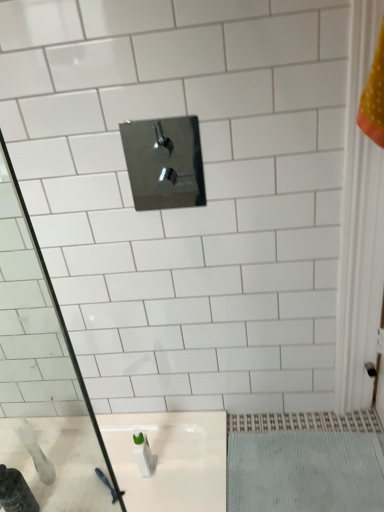
Locate an element on the screen. This screenshot has width=384, height=512. white textured bath mat at lower right is located at coordinates pos(303,472).

From the image's perspective, between polished chrome tap at upper center and white glossy bottle at lower left, which one is located above?

polished chrome tap at upper center appears higher in the image.

From a real-world perspective, is polished chrome tap at upper center physically located above or below white glossy bottle at lower left?

polished chrome tap at upper center is above white glossy bottle at lower left.

Is polished chrome tap at upper center facing away from white glossy bottle at lower left?

No, polished chrome tap at upper center is not facing the opposite direction of white glossy bottle at lower left.

Can we say polished chrome tap at upper center lies outside white glossy bottle at lower left?

Yes, polished chrome tap at upper center is located beyond the bounds of white glossy bottle at lower left.

From a real-world perspective, who is located lower, white textured bath mat at lower right or polished chrome tap at upper center?

In real-world perspective, white textured bath mat at lower right is lower.

Consider the image. Which is behind, white textured bath mat at lower right or polished chrome tap at upper center?

white textured bath mat at lower right is further from the camera.

Find the location of a particular element. This screenshot has height=512, width=384. bath mat on the right of polished chrome tap at upper center is located at coordinates (303, 472).

Between white textured bath mat at lower right and polished chrome tap at upper center, which one has smaller size?

Smaller between the two is polished chrome tap at upper center.

In terms of width, does white glossy bottle at lower left look wider or thinner when compared to white textured bath mat at lower right?

Clearly, white glossy bottle at lower left has less width compared to white textured bath mat at lower right.

Would you say white glossy bottle at lower left is outside white textured bath mat at lower right?

white glossy bottle at lower left lies outside white textured bath mat at lower right's area.

From a real-world perspective, is white glossy bottle at lower left above or below white textured bath mat at lower right?

From a real-world perspective, white glossy bottle at lower left is physically above white textured bath mat at lower right.

Which is behind, point (8, 505) or point (326, 500)?

Point (8, 505)

Is the depth of white textured bath mat at lower right greater than that of white glossy bottle at lower left?

No, white textured bath mat at lower right is closer to the viewer.

Consider the image. From the image's perspective, is white textured bath mat at lower right located beneath white glossy bottle at lower left?

No.

Considering the relative positions of white textured bath mat at lower right and white glossy bottle at lower left in the image provided, is white textured bath mat at lower right to the left or to the right of white glossy bottle at lower left?

white textured bath mat at lower right is to the right of white glossy bottle at lower left.

The height and width of the screenshot is (512, 384). In order to click on bath mat directly beneath the white glossy bottle at lower left (from a real-world perspective) in this screenshot , I will do `click(303, 472)`.

Is the depth of polished chrome tap at upper center greater than that of white textured bath mat at lower right?

No.

In the scene shown: Considering the sizes of polished chrome tap at upper center and white textured bath mat at lower right in the image, is polished chrome tap at upper center wider or thinner than white textured bath mat at lower right?

In the image, polished chrome tap at upper center appears to be more narrow than white textured bath mat at lower right.

In the image, there is a white textured bath mat at lower right. At what (x,y) coordinates should I click in order to perform the action: click on tap above it (from the image's perspective). Please return your answer as a coordinate pair (x, y). Looking at the image, I should click on (164, 163).

From the image's perspective, is polished chrome tap at upper center on white textured bath mat at lower right?

Yes, from the image's perspective, polished chrome tap at upper center is over white textured bath mat at lower right.

Considering the sizes of objects white glossy bottle at lower left and polished chrome tap at upper center in the image provided, who is thinner, white glossy bottle at lower left or polished chrome tap at upper center?

With smaller width is polished chrome tap at upper center.

Is white glossy bottle at lower left placed right next to polished chrome tap at upper center?

white glossy bottle at lower left and polished chrome tap at upper center are not in contact.

Is white glossy bottle at lower left completely or partially outside of polished chrome tap at upper center?

Absolutely, white glossy bottle at lower left is external to polished chrome tap at upper center.

From a real-world perspective, which object rests below the other?

white glossy bottle at lower left.

Image resolution: width=384 pixels, height=512 pixels. Identify the location of bottle below the polished chrome tap at upper center (from the image's perspective). (16, 492).

Identify the location of bath mat that appears below the polished chrome tap at upper center (from a real-world perspective). (303, 472).

Looking at the image, which one is located closer to white textured bath mat at lower right, polished chrome tap at upper center or white glossy bottle at lower left?

white glossy bottle at lower left is positioned closer to the anchor white textured bath mat at lower right.

Based on the photo, considering their positions, is white textured bath mat at lower right positioned further to white glossy bottle at lower left than polished chrome tap at upper center?

The object further to white glossy bottle at lower left is polished chrome tap at upper center.

Estimate the real-world distances between objects in this image. Which object is further from white textured bath mat at lower right, white glossy bottle at lower left or polished chrome tap at upper center?

polished chrome tap at upper center lies further to white textured bath mat at lower right than the other object.

Based on their spatial positions, is polished chrome tap at upper center or white textured bath mat at lower right closer to white glossy bottle at lower left?

white textured bath mat at lower right.

From the image, which object appears to be farther from polished chrome tap at upper center, white textured bath mat at lower right or white glossy bottle at lower left?

The object further to polished chrome tap at upper center is white glossy bottle at lower left.

Which object lies further to the anchor point polished chrome tap at upper center, white glossy bottle at lower left or white textured bath mat at lower right?

The object further to polished chrome tap at upper center is white glossy bottle at lower left.

Identify the location of bath mat between polished chrome tap at upper center and white glossy bottle at lower left in the up-down direction. (303, 472).